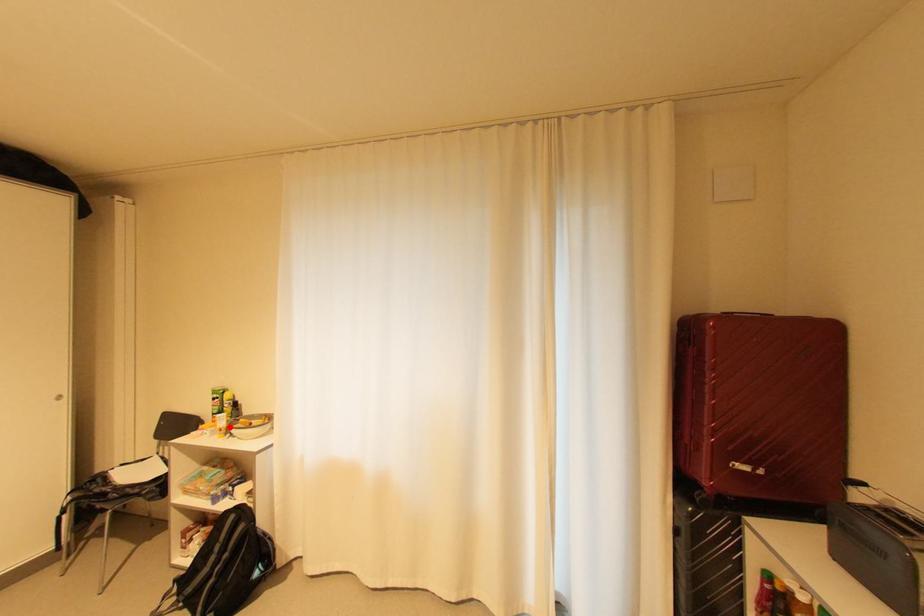
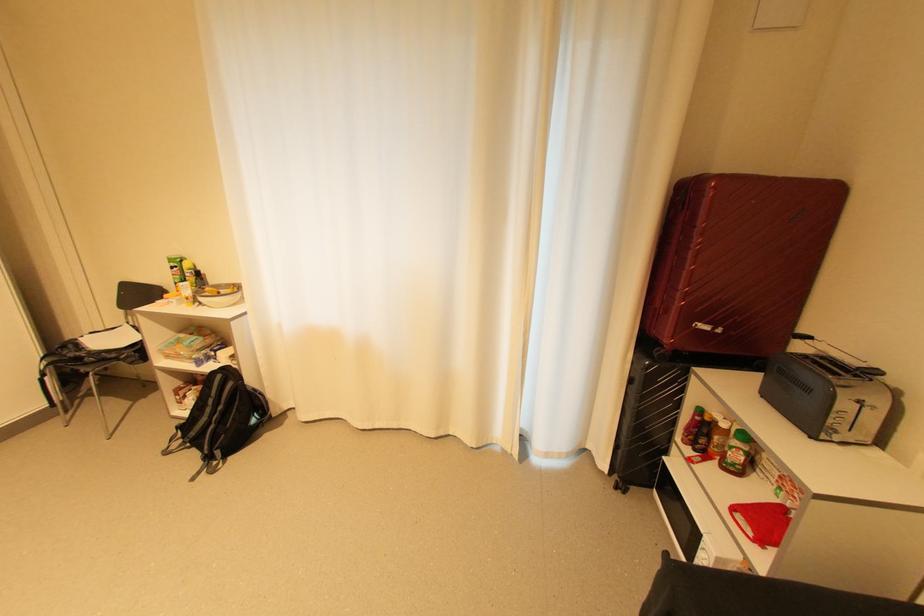
Find the pixel in the second image that matches the highlighted location in the first image.

(196, 296)